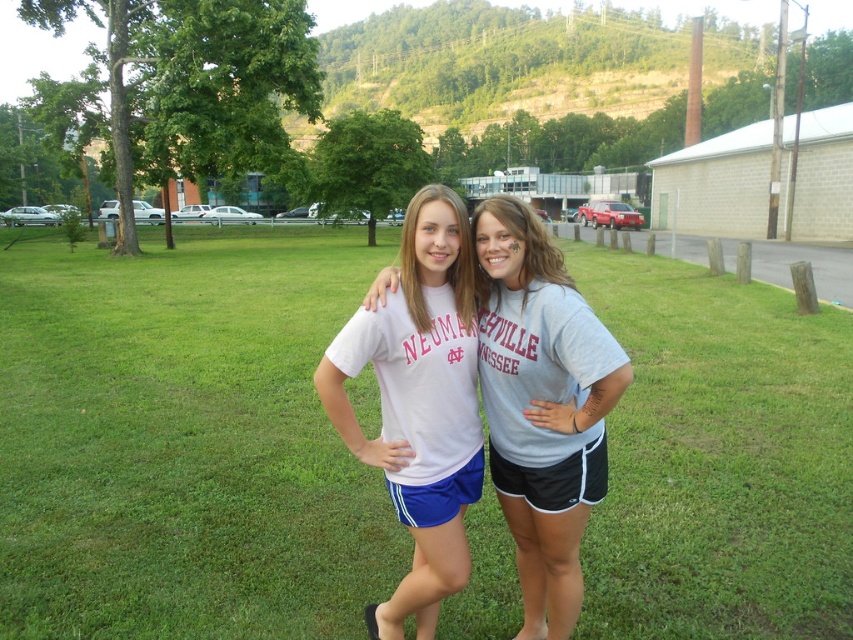
Looking at this image, you are a photographer setting up a shot. You need to place a small tripod between the green grass at center and the white matte shorts at center. Which side of the tripod should face the wider object?

The green grass at center is wider than the white matte shorts at center. Therefore, the tripod should face the green grass at center as it is the wider object.